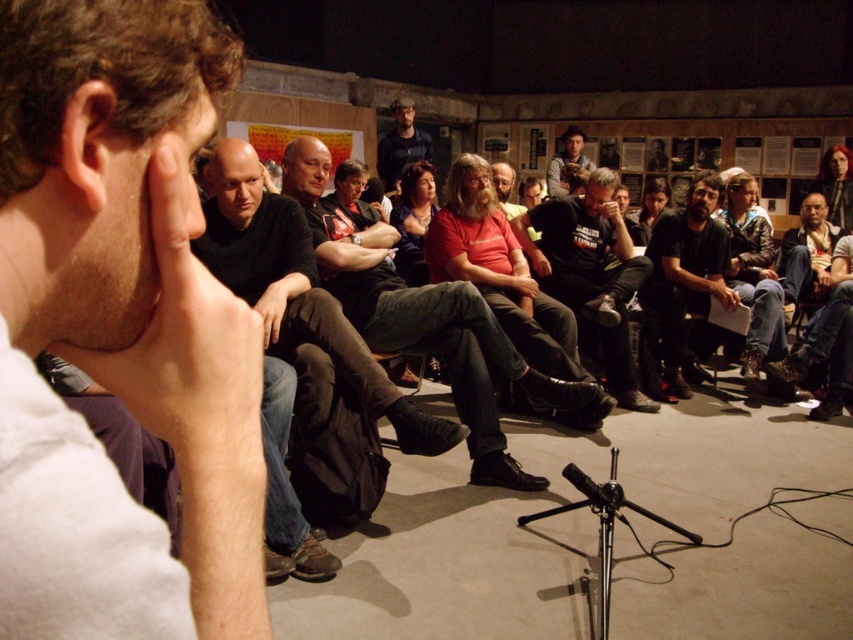
Question: Among these points, which one is nearest to the camera?

Choices:
 (A) (514, 360)
 (B) (213, 547)

Answer: (B)

Question: Which of the following is the farthest from the observer?

Choices:
 (A) matte black shirt at center
 (B) dark gray sweater at center

Answer: (A)

Question: Does dark gray sweater at center come behind matte black shirt at center?

Choices:
 (A) yes
 (B) no

Answer: (B)

Question: Which of the following is the closest to the observer?

Choices:
 (A) dark blue shirt at center
 (B) matte red shirt at center
 (C) matte black shirt at center
 (D) matte black shirt at left

Answer: (D)

Question: From the image, what is the correct spatial relationship of dark brown leather jacket at center in relation to black metallic microphone at center?

Choices:
 (A) below
 (B) above

Answer: (B)

Question: Does matte red shirt at center have a lesser width compared to dark blue shirt at center?

Choices:
 (A) yes
 (B) no

Answer: (A)